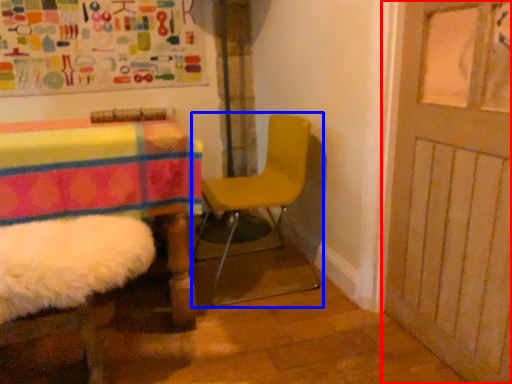
Question: Which point is further to the camera, door (highlighted by a red box) or chair (highlighted by a blue box)?

Choices:
 (A) door
 (B) chair

Answer: (B)